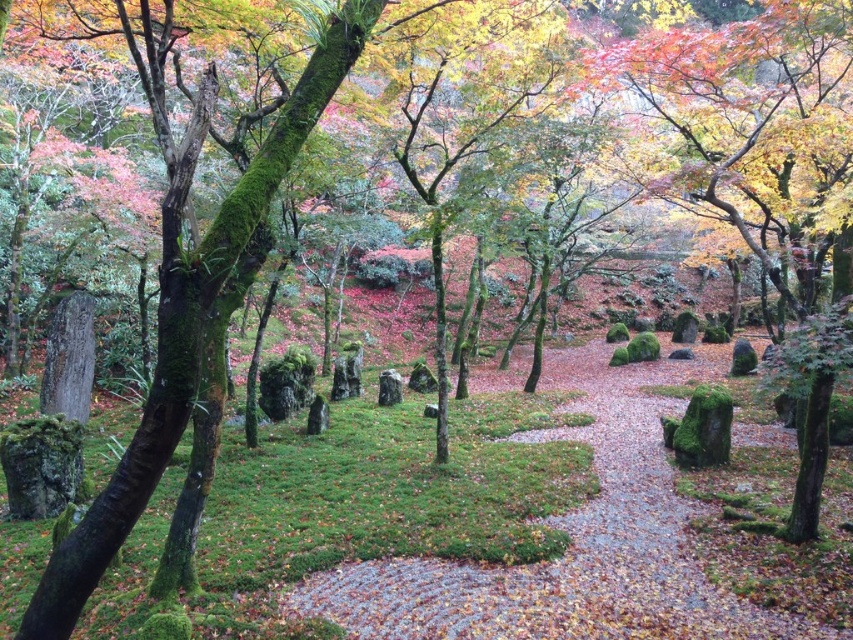
Question: Is autumn leaves at center above green mossy tree at left?

Choices:
 (A) no
 (B) yes

Answer: (B)

Question: Considering the relative positions of autumn leaves at center and green mossy tree at left in the image provided, where is autumn leaves at center located with respect to green mossy tree at left?

Choices:
 (A) below
 (B) above

Answer: (B)

Question: Which point is closer to the camera?

Choices:
 (A) autumn leaves at center
 (B) green mossy tree at left

Answer: (B)

Question: Which point appears farthest from the camera in this image?

Choices:
 (A) (795, 132)
 (B) (67, 577)

Answer: (A)

Question: Observing the image, what is the correct spatial positioning of autumn leaves at center in reference to green mossy tree at left?

Choices:
 (A) left
 (B) right

Answer: (B)